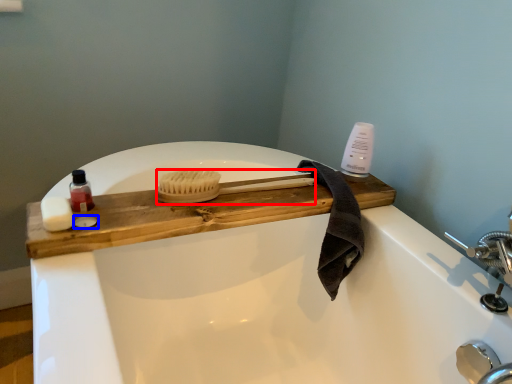
Question: Which point is further to the camera, brush (highlighted by a red box) or soap (highlighted by a blue box)?

Choices:
 (A) brush
 (B) soap

Answer: (A)